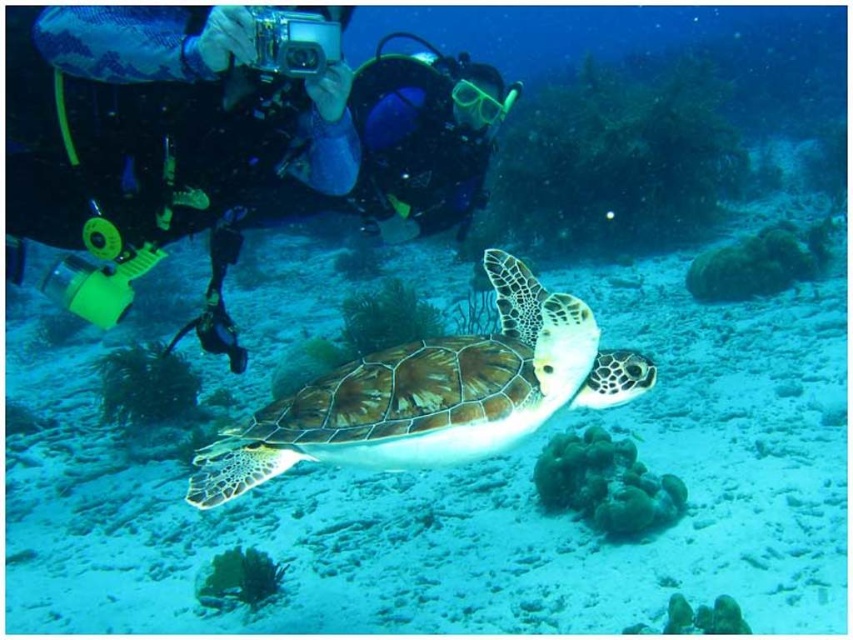
You are a marine biologist studying underwater landmarks. You need to locate the green textured shell at center. According to the coordinates provided, where would you find it?

The green textured shell at center is located at coordinates point (434, 394).

In the scene shown: You are a marine biologist studying underwater life. You notice a point at coordinates [434,394] in the image. What object is located at that point?

The point at coordinates [434,394] corresponds to the green textured shell at center.